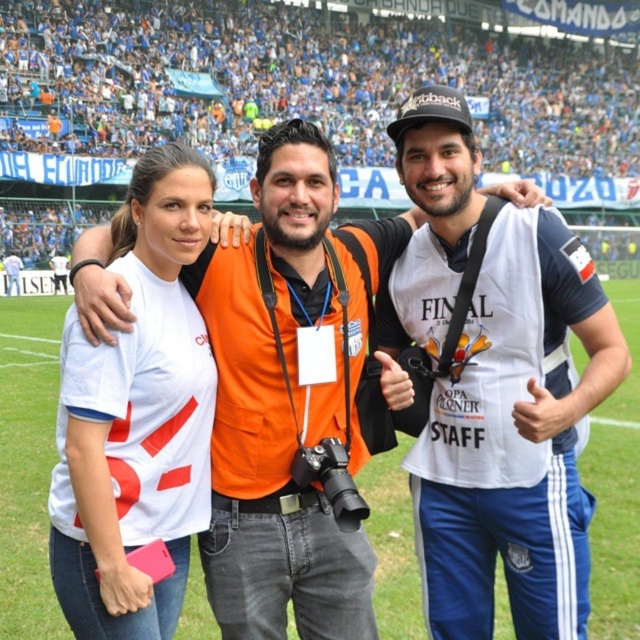
Question: Which is nearer to the white matte t-shirt at center?

Choices:
 (A) white jersey at center
 (B) orange fabric shirt at center

Answer: (B)

Question: Can you confirm if white jersey at center is positioned to the left of orange fabric shirt at center?

Choices:
 (A) yes
 (B) no

Answer: (B)

Question: Does orange fabric shirt at center come behind white matte t-shirt at center?

Choices:
 (A) yes
 (B) no

Answer: (A)

Question: Which object appears farthest from the camera in this image?

Choices:
 (A) orange fabric shirt at center
 (B) white matte t-shirt at center
 (C) white jersey at center

Answer: (C)

Question: Is white jersey at center bigger than white matte t-shirt at center?

Choices:
 (A) no
 (B) yes

Answer: (B)

Question: Which point is farther to the camera?

Choices:
 (A) (582, 525)
 (B) (54, 474)

Answer: (B)